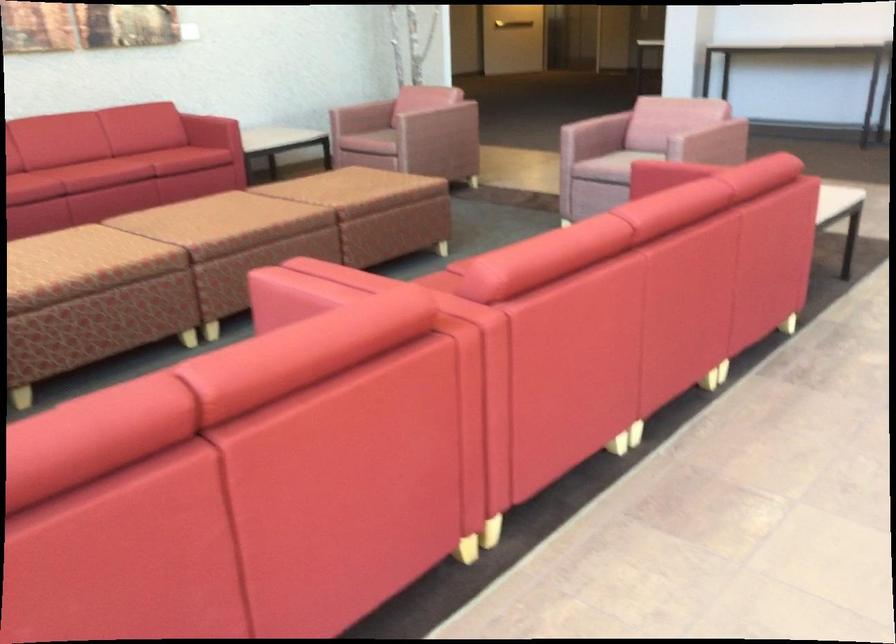
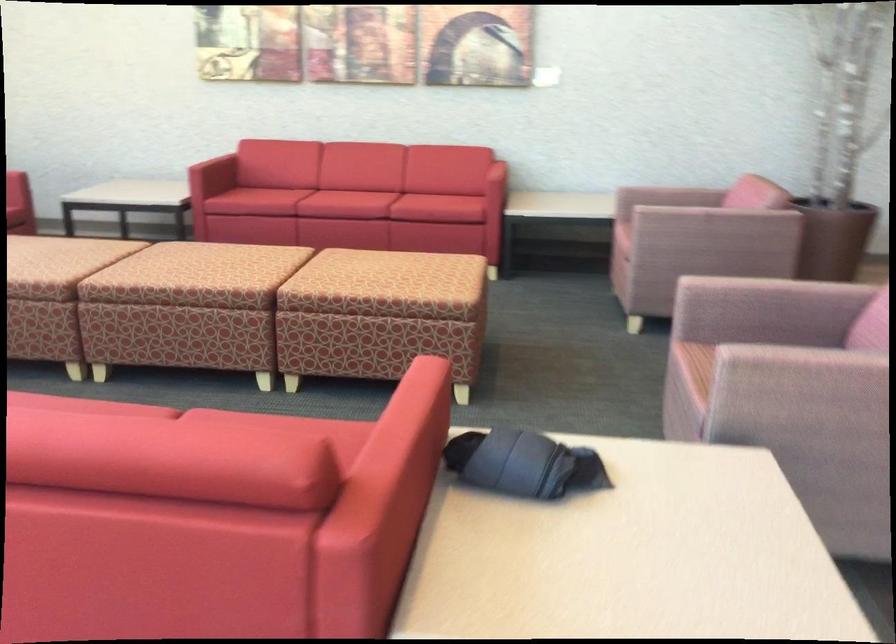
In the second image, find the point that corresponds to point (582, 124) in the first image.

(728, 278)